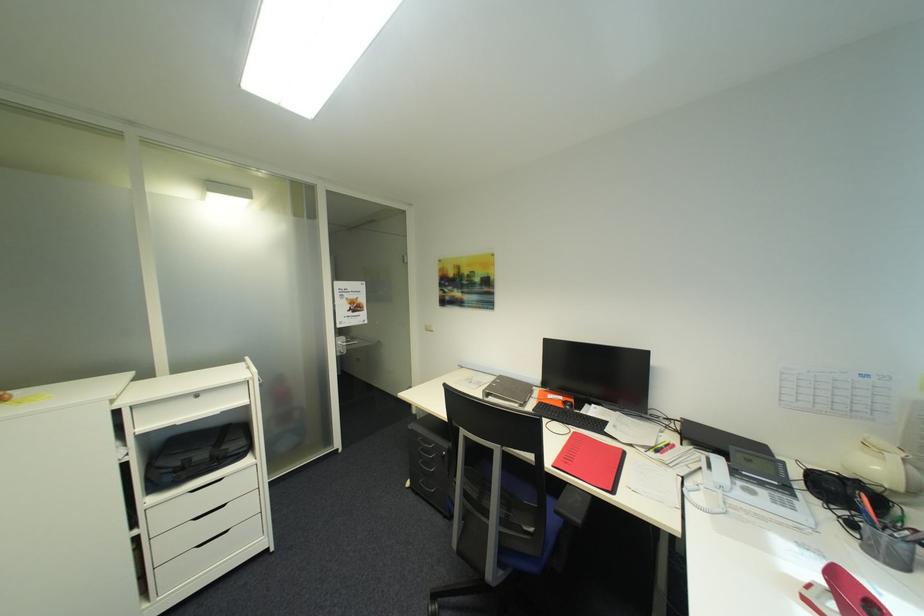
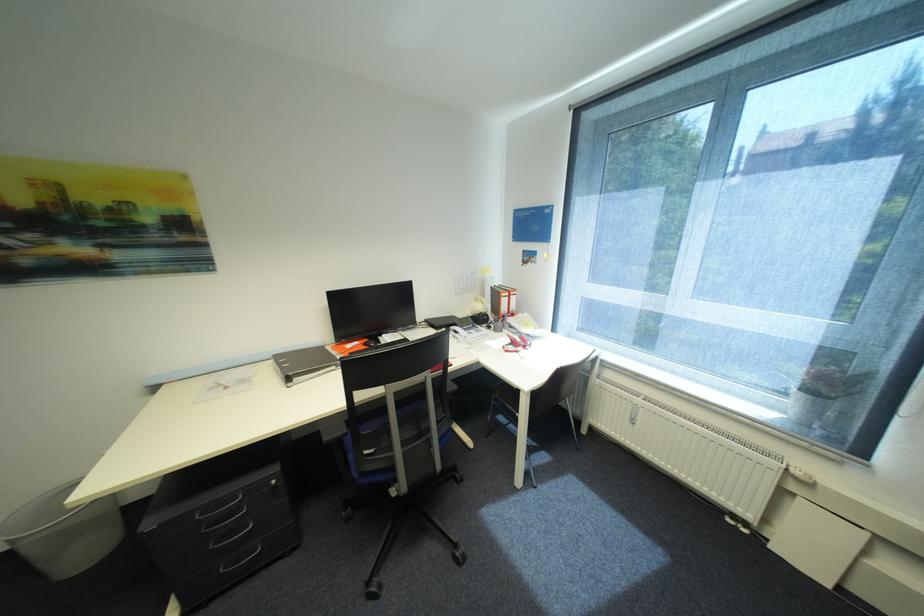
Question: The camera is either moving clockwise (left) or counter-clockwise (right) around the object. The first image is from the beginning of the video and the second image is from the end. Is the camera moving left or right when shooting the video?

Choices:
 (A) Left
 (B) Right

Answer: (A)